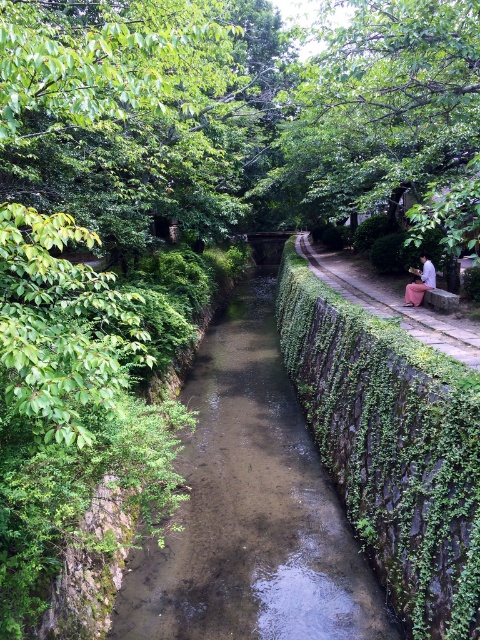
You are standing on the paved pathway next to the canal and want to place a small potted plant between the clear water stream at center and the pink fabric at right. Based on their sizes, which object should the potted plant be closer to?

The clear water stream at center is shorter than the pink fabric at right, so the potted plant should be placed closer to the clear water stream at center to maintain visual balance between the two objects.

You are standing on the paved pathway next to the canal. You want to take a photo of the clear water stream at center and the light pink fabric at right in the same frame. Which object should you position closer to the camera to ensure both are in focus?

To ensure both the clear water stream at center and the light pink fabric at right are in focus, position the light pink fabric at right closer to the camera since it is behind the clear water stream at center.

Based on the scene description, where is the clear water stream at center located in terms of coordinates?

The clear water stream at center is located at coordinates point (x=250, y=508).